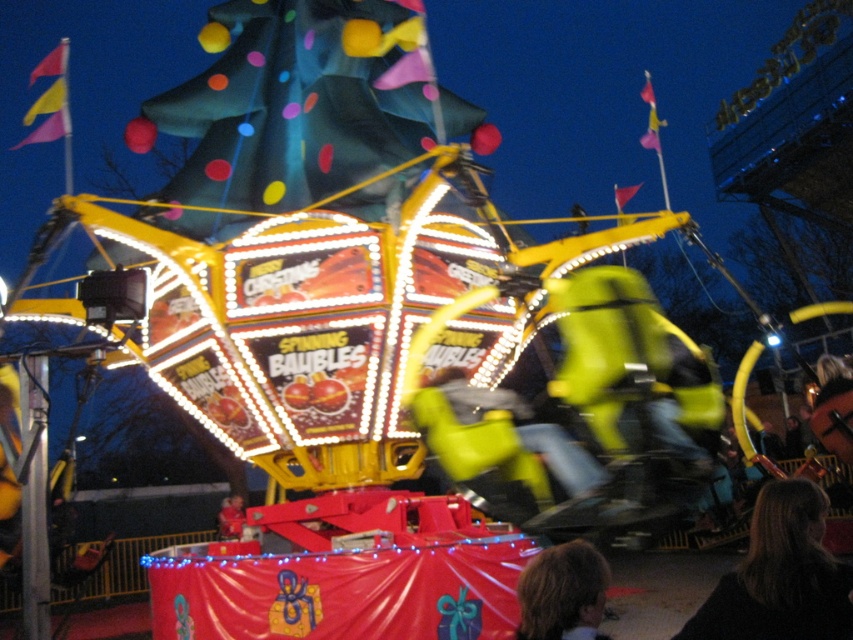
You are a photographer standing at the center of the fairground. You want to take a photo of the dark brown hair at lower right and the smooth red shirt at lower center in the same frame. Given that your camera has a maximum zoom range of 100 feet, will you be able to capture both subjects in one shot?

The distance between the dark brown hair at lower right and the smooth red shirt at lower center is 136.78 feet. Since your camera can only zoom up to 100 feet, you won be able to capture both subjects in a single shot without moving closer.